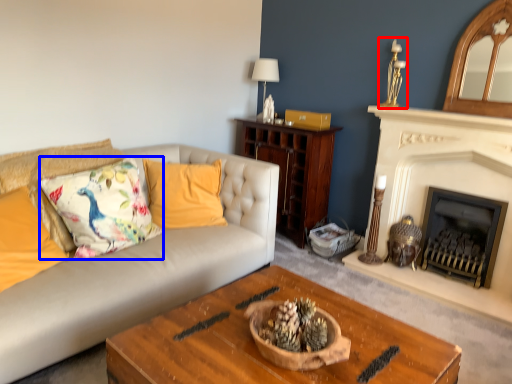
Question: Which object is closer to the camera taking this photo, candle holder (highlighted by a red box) or throw pillow (highlighted by a blue box)?

Choices:
 (A) candle holder
 (B) throw pillow

Answer: (B)